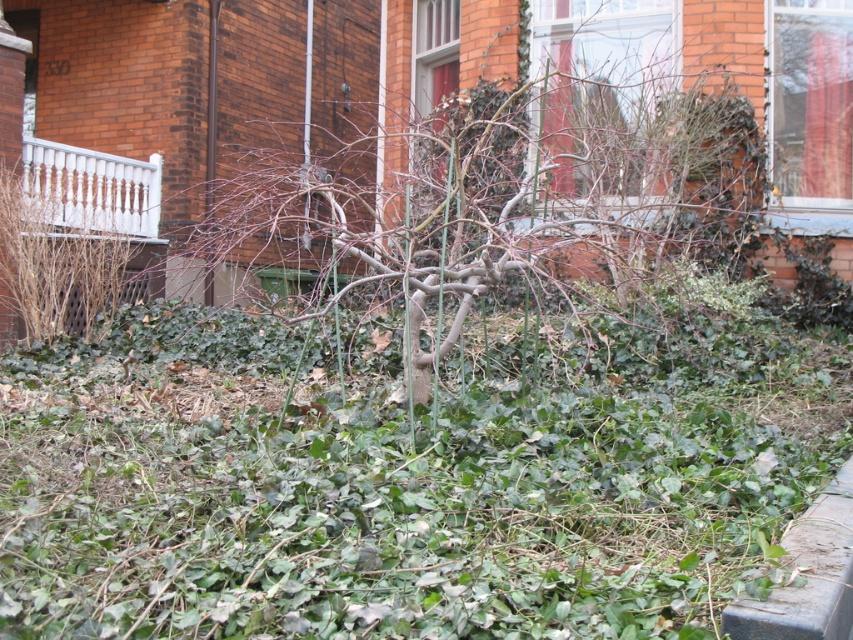
Does green leafy grass at center appear on the right side of bare branches at center?

Correct, you'll find green leafy grass at center to the right of bare branches at center.

In the scene shown: Who is shorter, green leafy grass at center or bare branches at center?

Standing shorter between the two is green leafy grass at center.

Between point (457, 628) and point (366, 172), which one is positioned in front?

Point (457, 628) is more forward.

Locate an element on the screen. Image resolution: width=853 pixels, height=640 pixels. green leafy grass at center is located at coordinates (402, 490).